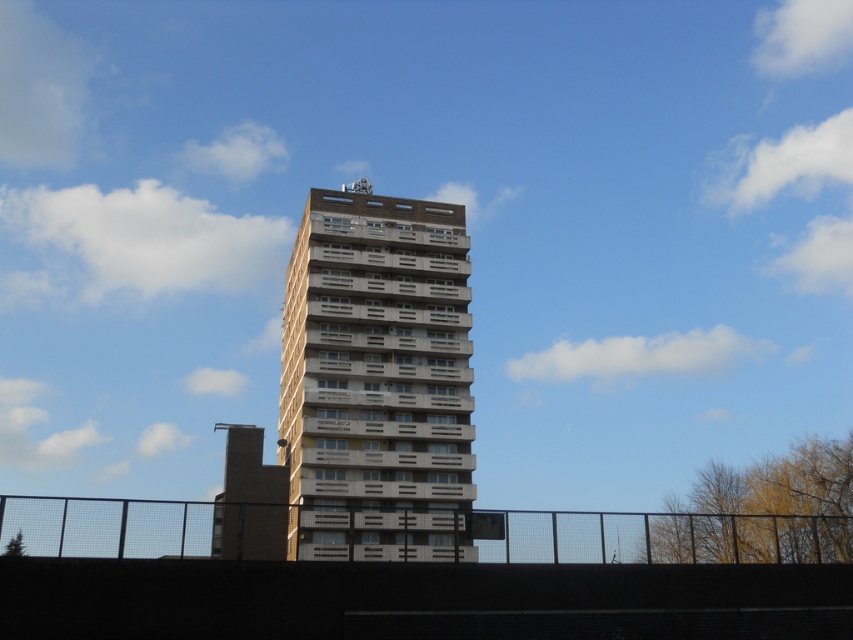
Question: Is beige concrete tower block at center to the right of black metal fence at lower center from the viewer's perspective?

Choices:
 (A) no
 (B) yes

Answer: (A)

Question: Is the position of beige concrete tower block at center more distant than that of black metal fence at lower center?

Choices:
 (A) no
 (B) yes

Answer: (B)

Question: Which point is closer to the camera taking this photo?

Choices:
 (A) (368, 481)
 (B) (672, 536)

Answer: (B)

Question: Is beige concrete tower block at center below black metal fence at lower center?

Choices:
 (A) yes
 (B) no

Answer: (B)